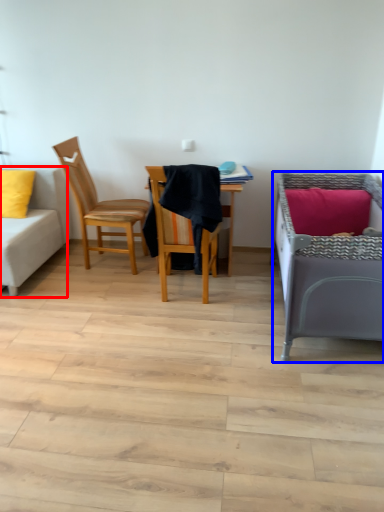
Question: Which of the following is the farthest to the observer, studio couch (highlighted by a red box) or infant bed (highlighted by a blue box)?

Choices:
 (A) studio couch
 (B) infant bed

Answer: (A)